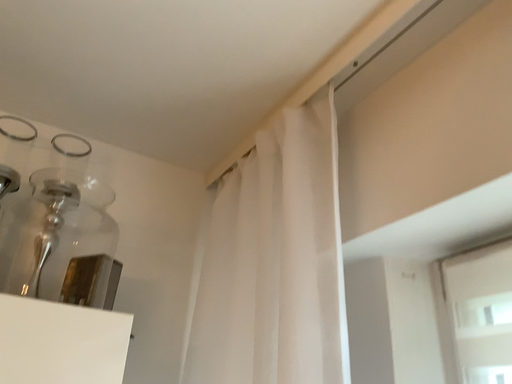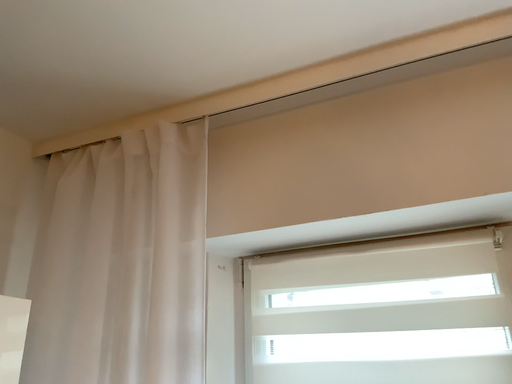
Question: Which way did the camera rotate in the video?

Choices:
 (A) rotated downward
 (B) rotated upward

Answer: (A)